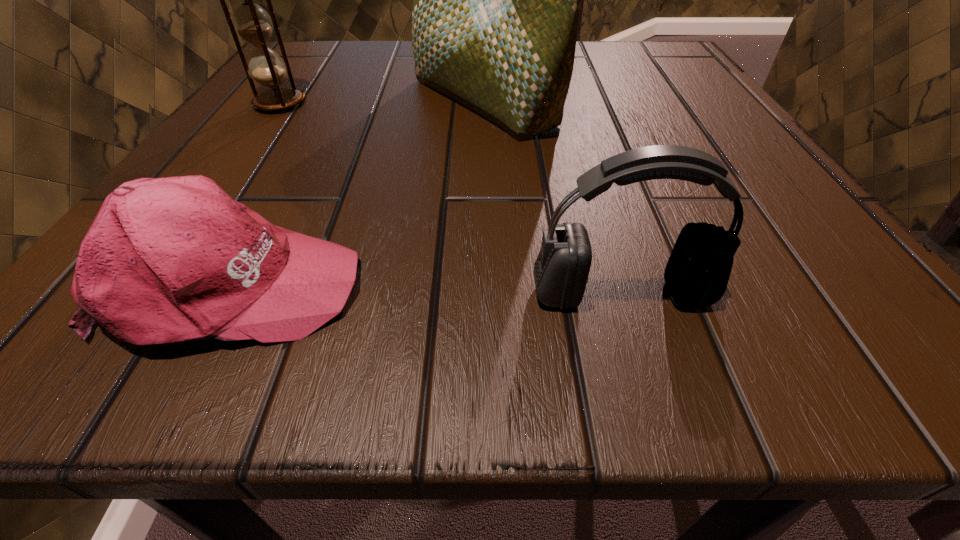
The image size is (960, 540). What are the coordinates of `free space between the shortest object and the hourglass` in the screenshot? It's located at (256, 194).

This screenshot has width=960, height=540. In order to click on vacant point located between the baseball cap and the hourglass in this screenshot , I will do `click(256, 194)`.

You are a GUI agent. You are given a task and a screenshot of the screen. Output one action in this format:
    pyautogui.click(x=<x>, y=<y>)
    Task: Click on the free space between the headset and the baseball cap
    This screenshot has height=540, width=960.
    Given the screenshot: What is the action you would take?
    pyautogui.click(x=427, y=289)

Image resolution: width=960 pixels, height=540 pixels. Identify the location of the third closest object to the hourglass. (697, 273).

Where is `the third closest object to the hourglass`? the third closest object to the hourglass is located at coordinates (697, 273).